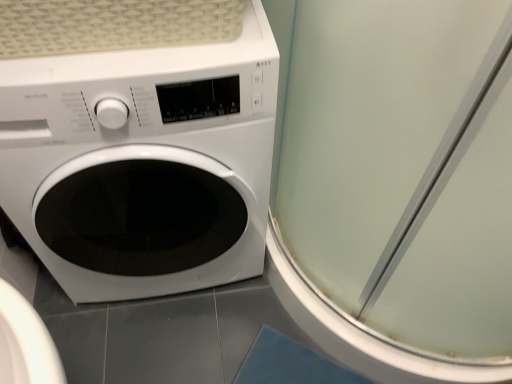
Question: Is transparent glass screen door at right to the left or to the right of white glossy washing machine at left in the image?

Choices:
 (A) left
 (B) right

Answer: (B)

Question: Considering their positions, is transparent glass screen door at right located in front of or behind white glossy washing machine at left?

Choices:
 (A) behind
 (B) front

Answer: (B)

Question: Is transparent glass screen door at right bigger or smaller than white glossy washing machine at left?

Choices:
 (A) big
 (B) small

Answer: (A)

Question: From a real-world perspective, is white glossy washing machine at left physically located above or below transparent glass screen door at right?

Choices:
 (A) below
 (B) above

Answer: (A)

Question: Which is correct: white glossy washing machine at left is inside transparent glass screen door at right, or outside of it?

Choices:
 (A) inside
 (B) outside

Answer: (B)

Question: Looking at their shapes, would you say white glossy washing machine at left is wider or thinner than transparent glass screen door at right?

Choices:
 (A) wide
 (B) thin

Answer: (B)

Question: Does point (160, 107) appear closer or farther from the camera than point (454, 244)?

Choices:
 (A) closer
 (B) farther

Answer: (B)